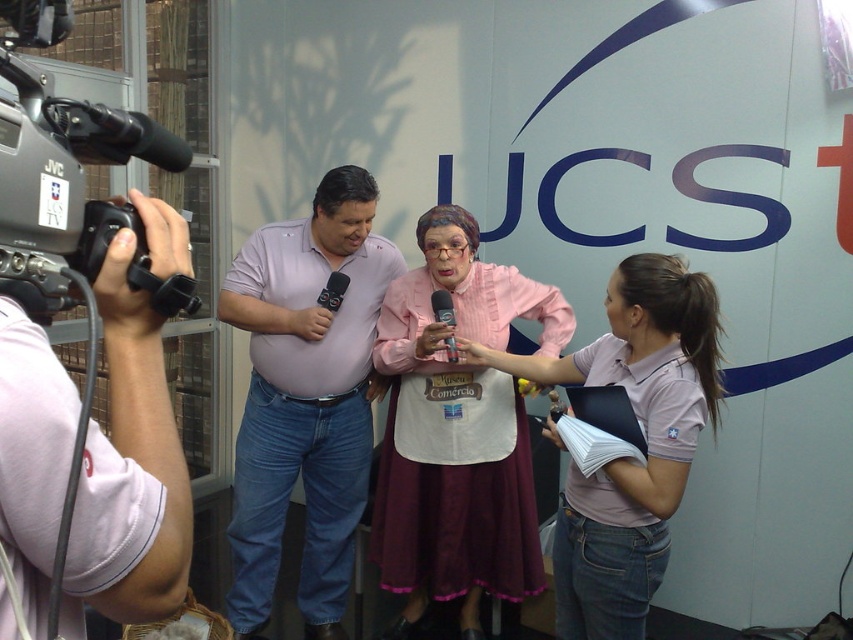
Question: Which point is farther to the camera?

Choices:
 (A) (479, 307)
 (B) (438, 291)
 (C) (563, 508)
 (D) (326, 282)

Answer: (D)

Question: Does pink cotton shirt at center appear on the left side of black plastic video camera at left?

Choices:
 (A) yes
 (B) no

Answer: (B)

Question: Can you confirm if pink cotton shirt at center is positioned below black matte microphone at center?

Choices:
 (A) yes
 (B) no

Answer: (A)

Question: Does pink fabric dress at center appear on the left side of black plastic video camera at left?

Choices:
 (A) no
 (B) yes

Answer: (A)

Question: Which point is closer to the camera?

Choices:
 (A) (544, 365)
 (B) (337, 486)

Answer: (A)

Question: Which point is closer to the camera taking this photo?

Choices:
 (A) (442, 316)
 (B) (390, 637)
 (C) (573, 634)

Answer: (C)